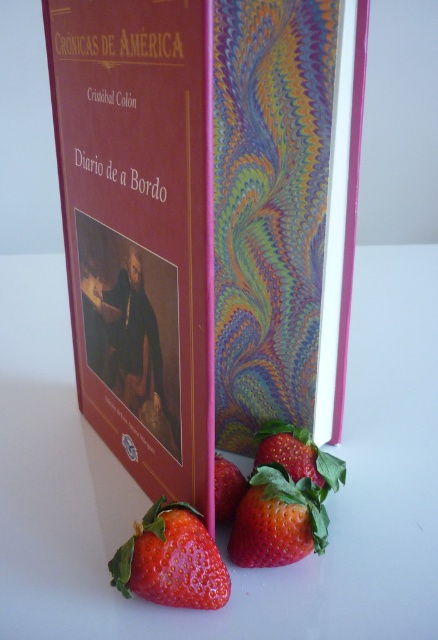
Question: Can you confirm if marbled paper book at center is thinner than red matte strawberry at lower left?

Choices:
 (A) yes
 (B) no

Answer: (B)

Question: Is marbled paper book at center positioned at the back of red matte strawberry at lower center?

Choices:
 (A) yes
 (B) no

Answer: (B)

Question: Which point appears farthest from the camera in this image?

Choices:
 (A) (276, 515)
 (B) (235, 512)
 (C) (172, 509)
 (D) (38, 323)

Answer: (D)

Question: Does marbled paper book at center have a larger size compared to red matte strawberry at lower left?

Choices:
 (A) yes
 (B) no

Answer: (A)

Question: Which object appears closest to the camera in this image?

Choices:
 (A) marbled paper book at center
 (B) red matte strawberry at lower center
 (C) red matte strawberry at center

Answer: (A)

Question: Which of the following is the closest to the observer?

Choices:
 (A) shiny red strawberry at lower center
 (B) smooth white table at center

Answer: (B)